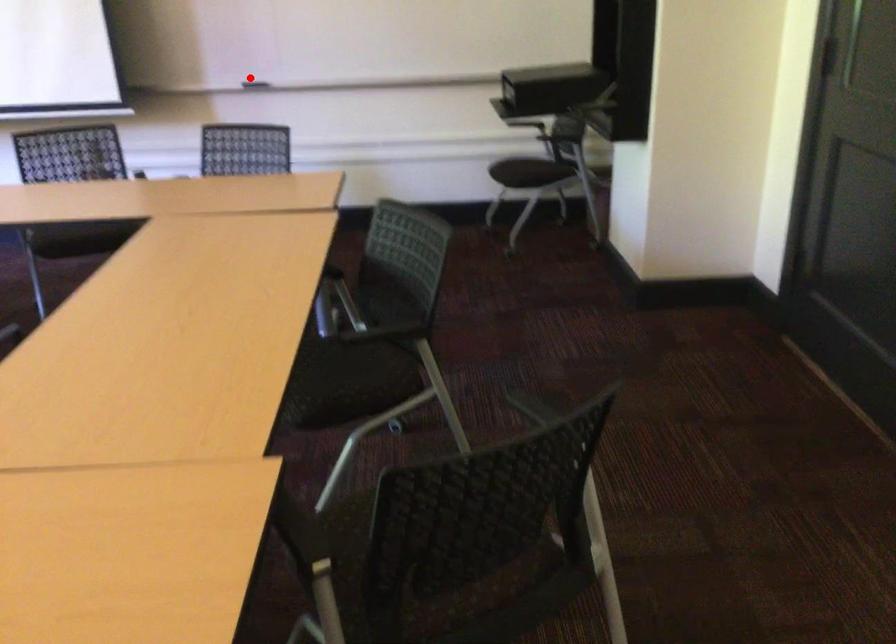
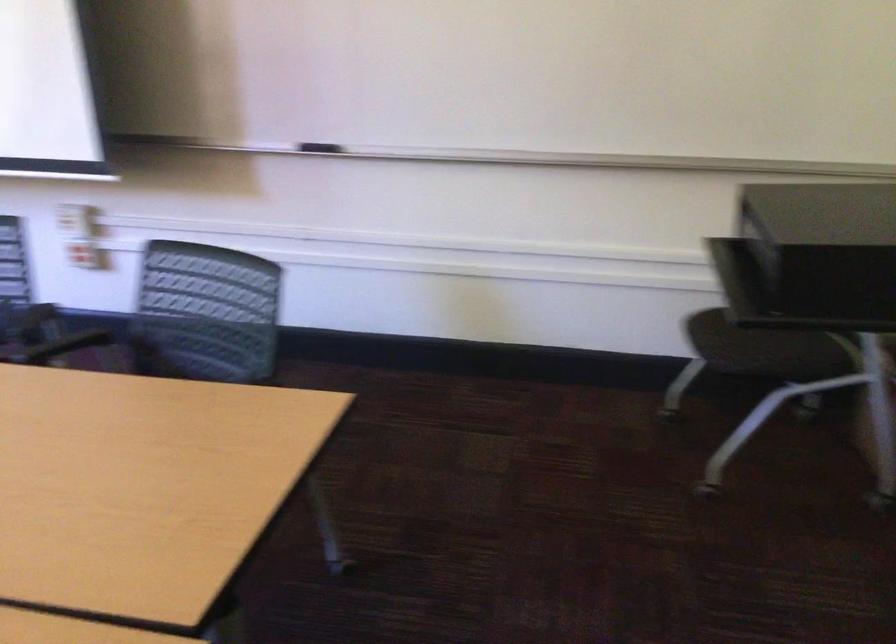
Question: I am providing you with two images of the same scene from different viewpoints. A red point is shown in image1. For the corresponding object point in image2, is it positioned nearer or farther from the camera?

Choices:
 (A) Nearer
 (B) Farther

Answer: (A)